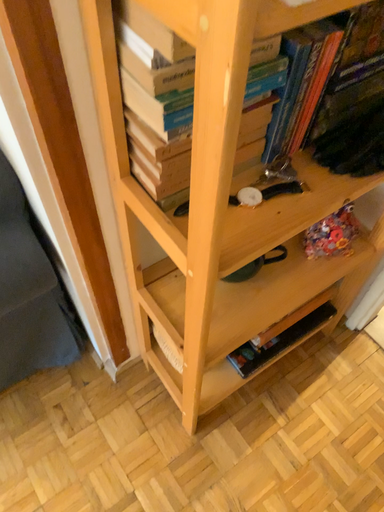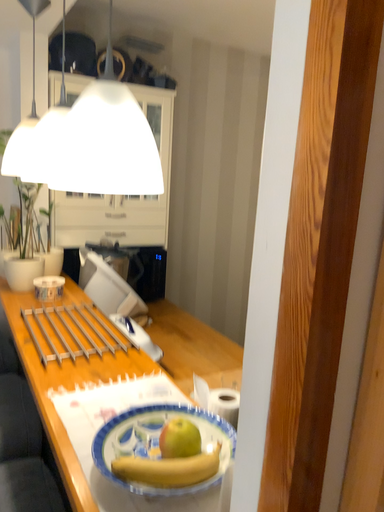
Question: Which way did the camera rotate in the video?

Choices:
 (A) rotated downward
 (B) rotated upward

Answer: (B)